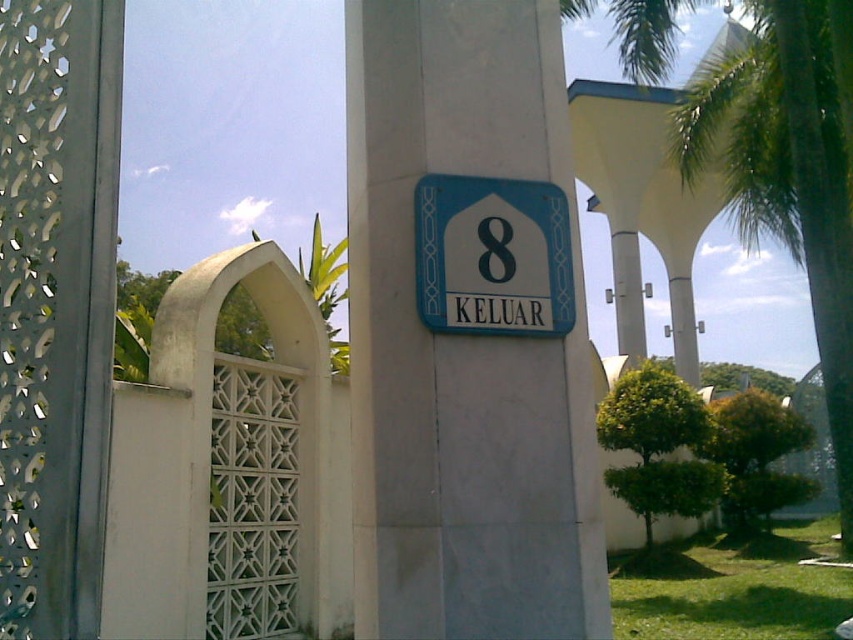
You are standing in front of the building shown in the image and need to locate a specific point for maintenance. The point you need to reach is labeled as point (462, 340). Based on the description, where exactly is this point located?

The point (462, 340) is on the white smooth pillar at center.

You are a painter who needs to cover the entire surface of the white smooth pillar at center and the blue plastic sign at center. Which object requires more paint considering their widths?

The white smooth pillar at center might require more paint than the blue plastic sign at center because it is wider.

You are standing in front of the building and want to locate the white smooth pillar at center. According to the coordinates provided, where should you look?

You should look at point (x=462, y=340) to find the white smooth pillar at center.